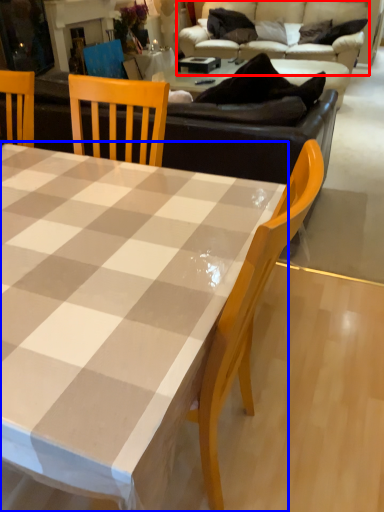
Question: Which point is closer to the camera, studio couch (highlighted by a red box) or coffee table (highlighted by a blue box)?

Choices:
 (A) studio couch
 (B) coffee table

Answer: (B)